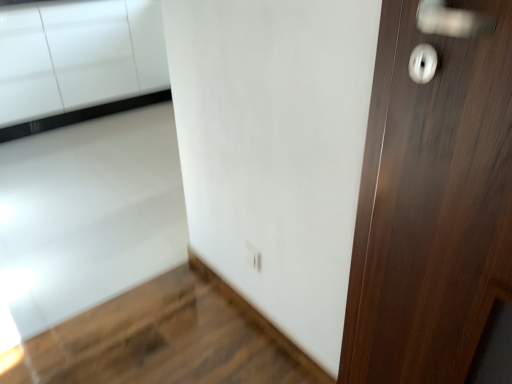
Question: From the image's perspective, is white glossy electric outlet at lower center under dark wood door at right?

Choices:
 (A) no
 (B) yes

Answer: (B)

Question: Can you confirm if white glossy electric outlet at lower center is positioned to the right of dark wood door at right?

Choices:
 (A) yes
 (B) no

Answer: (B)

Question: Is dark wood door at right surrounded by white glossy electric outlet at lower center?

Choices:
 (A) no
 (B) yes

Answer: (A)

Question: Does white glossy electric outlet at lower center have a greater width compared to dark wood door at right?

Choices:
 (A) no
 (B) yes

Answer: (A)

Question: From a real-world perspective, is white glossy electric outlet at lower center located higher than dark wood door at right?

Choices:
 (A) no
 (B) yes

Answer: (A)

Question: From the image's perspective, is white glossy cabinetry at lower left above or below dark wood door at right?

Choices:
 (A) below
 (B) above

Answer: (B)

Question: Relative to dark wood door at right, is white glossy cabinetry at lower left in front or behind?

Choices:
 (A) front
 (B) behind

Answer: (B)

Question: Is white glossy cabinetry at lower left taller or shorter than dark wood door at right?

Choices:
 (A) tall
 (B) short

Answer: (B)

Question: From a real-world perspective, is white glossy cabinetry at lower left above or below dark wood door at right?

Choices:
 (A) below
 (B) above

Answer: (A)

Question: Visually, is dark wood door at right positioned to the left or to the right of white glossy electric outlet at lower center?

Choices:
 (A) left
 (B) right

Answer: (B)

Question: In terms of height, does dark wood door at right look taller or shorter compared to white glossy electric outlet at lower center?

Choices:
 (A) tall
 (B) short

Answer: (A)

Question: In terms of width, does dark wood door at right look wider or thinner when compared to white glossy electric outlet at lower center?

Choices:
 (A) wide
 (B) thin

Answer: (A)

Question: From a real-world perspective, is dark wood door at right positioned above or below white glossy electric outlet at lower center?

Choices:
 (A) below
 (B) above

Answer: (B)

Question: Is point 260,258 closer or farther from the camera than point 410,21?

Choices:
 (A) closer
 (B) farther

Answer: (B)

Question: Considering the relative positions of white glossy electric outlet at lower center and dark wood door at right in the image provided, is white glossy electric outlet at lower center to the left or to the right of dark wood door at right?

Choices:
 (A) left
 (B) right

Answer: (A)